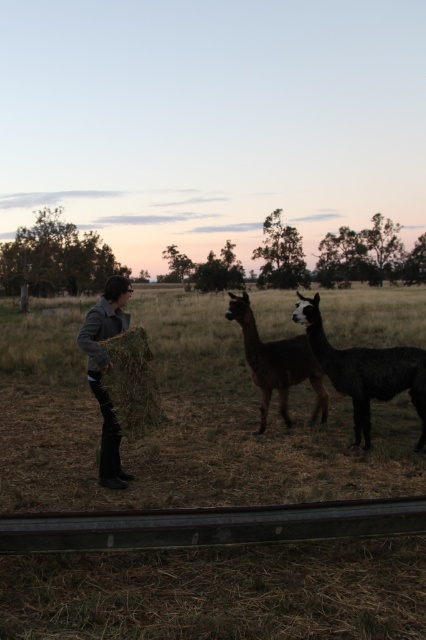
You are standing at a point in a rural area where you can see a person holding hay and two alpacas. There is a specific point marked at coordinates point [267,346]. If you want to place a small bench exactly 8 meters away from you, would the bench be placed closer to or farther from the marked point compared to your current position?

The distance between the marked point [267,346] and the viewer is 7.78 meters. If you place the bench 8 meters away from your current position, it would be slightly farther from the marked point than your current distance.

You are standing at the point labeled as point [365,371] in the image. What animal do you see immediately in front of you?

The point [365,371] corresponds to a dark brown woolly alpaca at right, so you would see the dark brown woolly alpaca at right immediately in front of you.